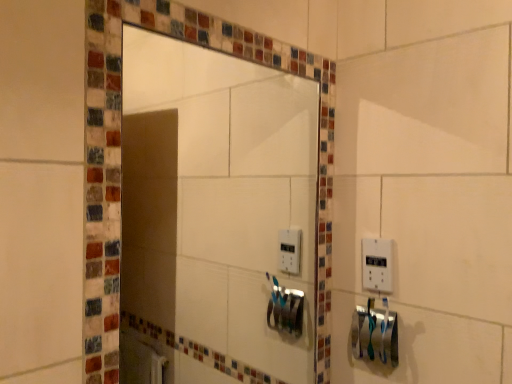
Question: From a real-world perspective, is white plastic light switch at right physically located above or below matte glass mirror at center?

Choices:
 (A) above
 (B) below

Answer: (B)

Question: Based on their sizes in the image, would you say white plastic light switch at right is bigger or smaller than matte glass mirror at center?

Choices:
 (A) big
 (B) small

Answer: (B)

Question: Which of these objects is positioned farthest from the white plastic light switch at right?

Choices:
 (A) silver metallic towel bar at lower right
 (B) matte glass mirror at center

Answer: (B)

Question: Estimate the real-world distances between objects in this image. Which object is farther from the silver metallic towel bar at lower right?

Choices:
 (A) matte glass mirror at center
 (B) white plastic light switch at right

Answer: (A)